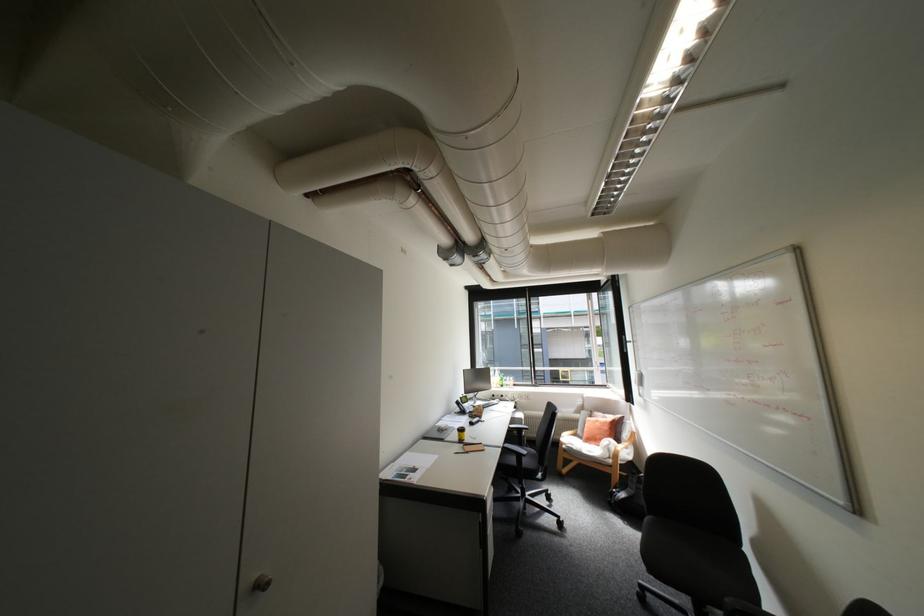
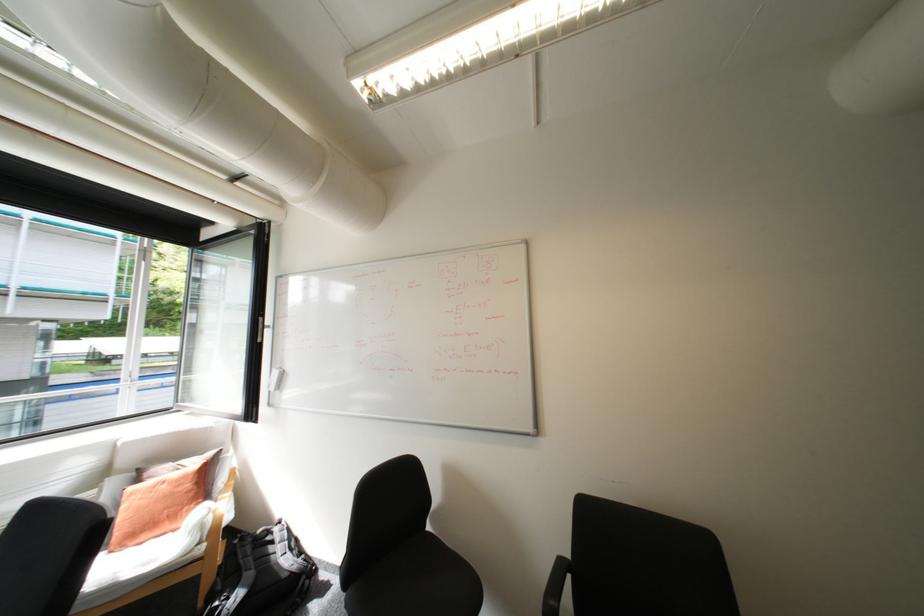
The point at [628,493] is marked in the first image. Where is the corresponding point in the second image?

(238, 599)